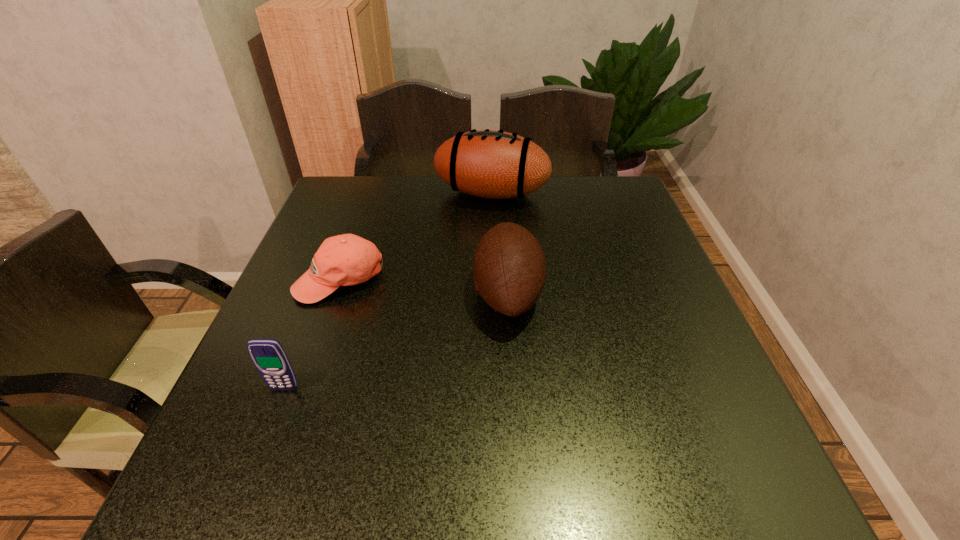
Identify the location of vacant space situated on the laces of the nearer football. (334, 293).

Locate an element on the screen. Image resolution: width=960 pixels, height=540 pixels. free region located 0.210m on the front-facing side of the third tallest object is located at coordinates (237, 511).

Locate an element on the screen. This screenshot has width=960, height=540. vacant space located on the front of the shortest object is located at coordinates click(x=281, y=448).

Where is `object that is at the far edge`? Image resolution: width=960 pixels, height=540 pixels. object that is at the far edge is located at coordinates (491, 164).

Find the location of a particular element. cellular telephone present at the left edge is located at coordinates (268, 355).

Locate an element on the screen. The width and height of the screenshot is (960, 540). baseball cap at the left edge is located at coordinates (343, 260).

The height and width of the screenshot is (540, 960). In the image, there is a desktop. In order to click on vacant space at the far edge in this screenshot , I will do [x=410, y=176].

Image resolution: width=960 pixels, height=540 pixels. Identify the location of vacant area at the near edge. (391, 456).

Locate an element on the screen. This screenshot has width=960, height=540. free spot at the left edge of the desktop is located at coordinates (313, 307).

The image size is (960, 540). I want to click on vacant space at the right edge, so click(x=662, y=296).